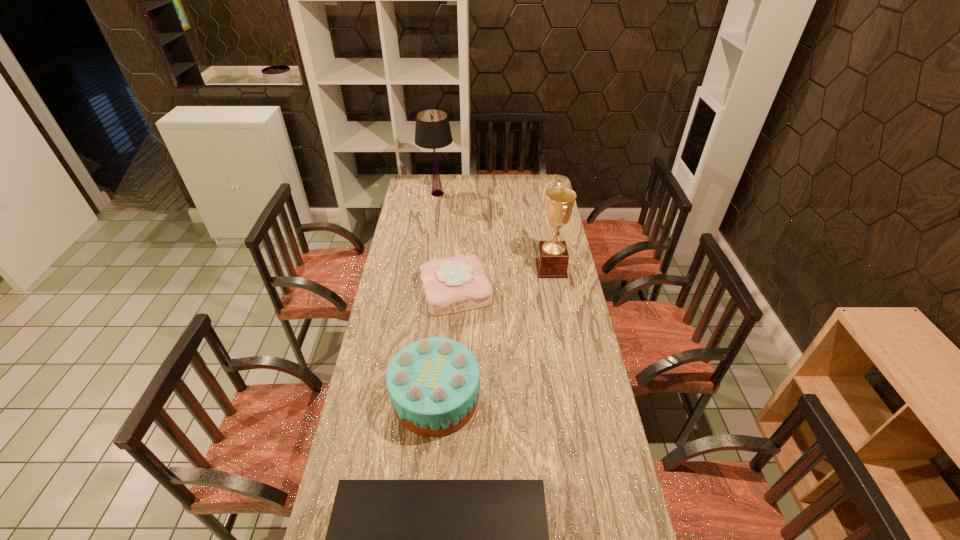
Image resolution: width=960 pixels, height=540 pixels. In order to click on free spot between the rightmost object and the taller cake in this screenshot , I will do `click(493, 333)`.

Where is `free spot between the farthest object and the rightmost object`? This screenshot has width=960, height=540. free spot between the farthest object and the rightmost object is located at coordinates (494, 231).

Identify the location of vacant area between the trophy cup and the shorter cake. (503, 280).

Identify which object is located as the nearest to the CD player. Please provide its 2D coordinates. Your answer should be formatted as a tuple, i.e. [(x, y)], where the tuple contains the x and y coordinates of a point satisfying the conditions above.

[(433, 383)]

The height and width of the screenshot is (540, 960). In order to click on the third closest object relative to the rightmost object in this screenshot , I will do `click(432, 131)`.

At what (x,y) coordinates should I click in order to perform the action: click on free spot that satisfies the following two spatial constraints: 1. on the front-facing side of the lampshade; 2. on the back side of the nearer cake. Please return your answer as a coordinate pair (x, y). The height and width of the screenshot is (540, 960). Looking at the image, I should click on (410, 399).

I want to click on free space that satisfies the following two spatial constraints: 1. on the back side of the farther cake; 2. on the front-facing side of the lampshade, so click(x=462, y=194).

Image resolution: width=960 pixels, height=540 pixels. I want to click on free spot that satisfies the following two spatial constraints: 1. on the front-facing side of the farthest object; 2. on the back side of the shorter cake, so click(424, 291).

Identify the location of vacant space that satisfies the following two spatial constraints: 1. on the plaque of the rightmost object; 2. on the front side of the farther cake. (555, 291).

The width and height of the screenshot is (960, 540). Find the location of `free spot that satisfies the following two spatial constraints: 1. on the plaque of the trophy cup; 2. on the front side of the nearer cake`. free spot that satisfies the following two spatial constraints: 1. on the plaque of the trophy cup; 2. on the front side of the nearer cake is located at coordinates pos(575,399).